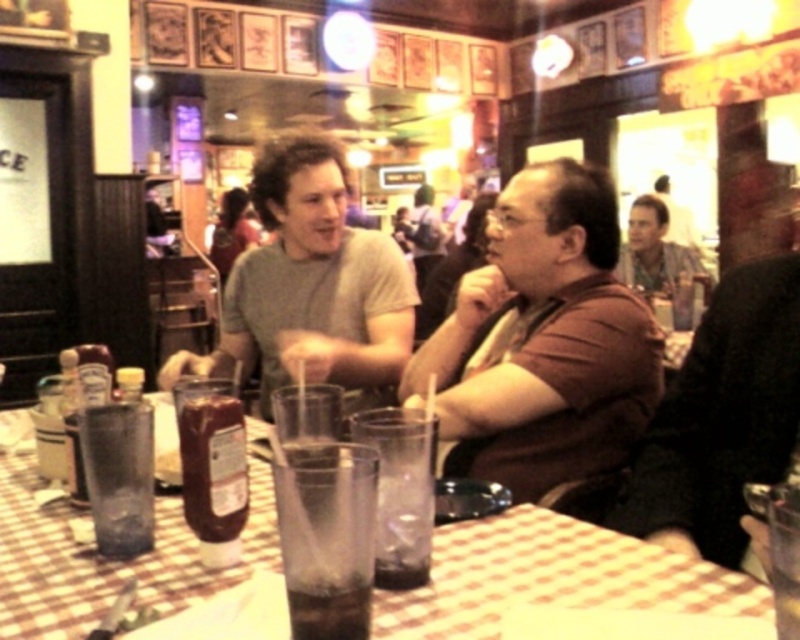
Is point (650, 500) positioned in front of point (308, 636)?

That is False.

Does brown leather jacket at right have a lesser width compared to dark brown liquid at table center?

Incorrect, brown leather jacket at right's width is not less than dark brown liquid at table center's.

Is point (766, 460) behind point (294, 596)?

That is True.

At what (x,y) coordinates should I click in order to perform the action: click on brown leather jacket at right. Please return your answer as a coordinate pair (x, y). Looking at the image, I should click on 722,417.

Describe the element at coordinates (722, 417) in the screenshot. I see `brown leather jacket at right` at that location.

Is brown leather jacket at right above clear plastic cup at center?

Correct, brown leather jacket at right is located above clear plastic cup at center.

Locate an element on the screen. The image size is (800, 640). brown leather jacket at right is located at coordinates (722, 417).

Which is below, checkered fabric table at center or dark brown liquid at table center?

Positioned lower is dark brown liquid at table center.

Between checkered fabric table at center and dark brown liquid at table center, which one is positioned higher?

checkered fabric table at center is higher up.

This screenshot has width=800, height=640. I want to click on checkered fabric table at center, so click(x=552, y=577).